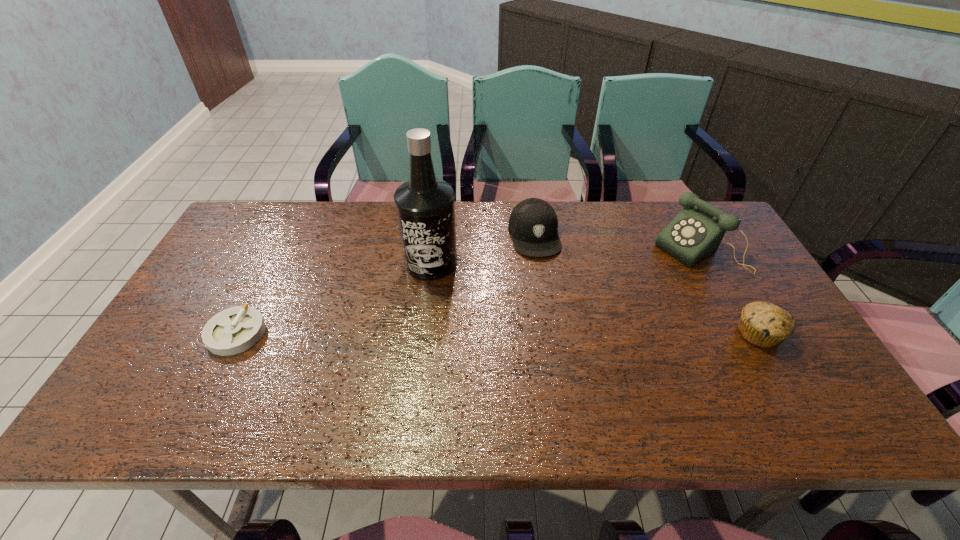
Identify the location of object that is the closest to the muffin. This screenshot has width=960, height=540. (695, 233).

Select which object is the second closest to the second object from left to right. Please provide its 2D coordinates. Your answer should be formatted as a tuple, i.e. [(x, y)], where the tuple contains the x and y coordinates of a point satisfying the conditions above.

[(234, 330)]

At what (x,y) coordinates should I click in order to perform the action: click on free space that satisfies the following two spatial constraints: 1. on the front side of the liquor; 2. on the right side of the muffin. Please return your answer as a coordinate pair (x, y). This screenshot has height=540, width=960. Looking at the image, I should click on (422, 334).